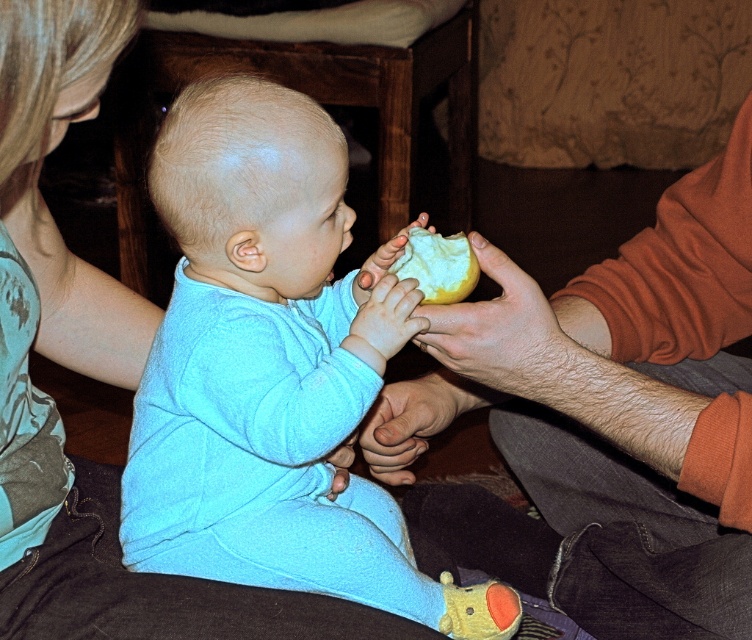
Between point (540, 445) and point (444, 268), which one is positioned in front?

Positioned in front is point (444, 268).

Is matte orange sweater at right below yellow matte apple at center?

Indeed, matte orange sweater at right is positioned under yellow matte apple at center.

Between point (653, 541) and point (426, 234), which one is positioned behind?

The point (653, 541) is behind.

This screenshot has height=640, width=752. I want to click on matte orange sweater at right, so click(x=605, y=419).

Who is positioned more to the right, light blue fleece baby at center or yellow matte apple at center?

From the viewer's perspective, yellow matte apple at center appears more on the right side.

Who is positioned more to the left, light blue fleece baby at center or yellow matte apple at center?

From the viewer's perspective, light blue fleece baby at center appears more on the left side.

In the scene shown: Who is more distant from viewer, (259, 454) or (468, 280)?

The point (468, 280) is behind.

In order to click on light blue fleece baby at center in this screenshot , I will do `click(271, 371)`.

Describe the element at coordinates (605, 419) in the screenshot. I see `matte orange sweater at right` at that location.

Is point (687, 188) in front of point (162, 419)?

No, it is behind (162, 419).

Measure the distance between matte orange sweater at right and camera.

matte orange sweater at right is 32.09 inches from camera.

You are a GUI agent. You are given a task and a screenshot of the screen. Output one action in this format:
    pyautogui.click(x=<x>, y=<y>)
    Task: Click on the matte orange sweater at right
    
    Given the screenshot: What is the action you would take?
    [605, 419]